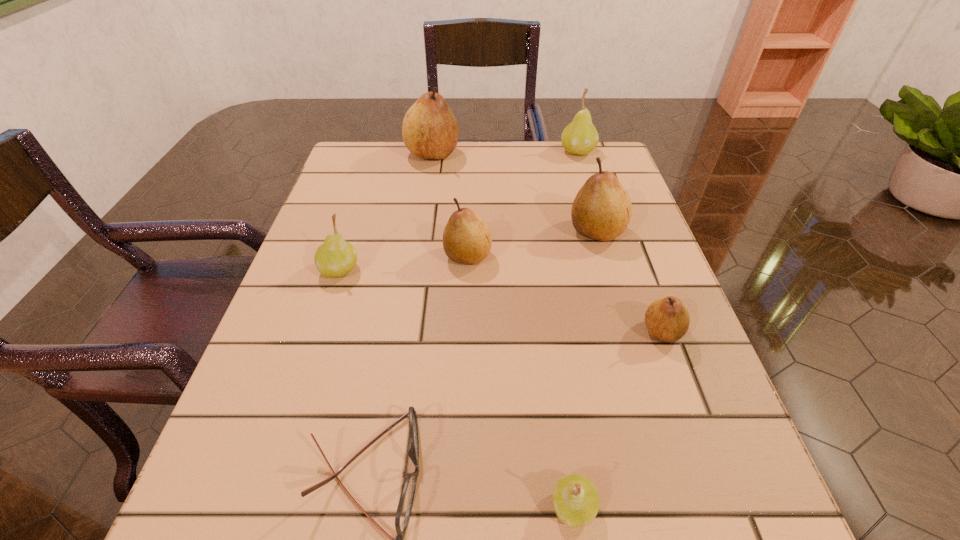
Where is `object at the far left corner`? object at the far left corner is located at coordinates tap(430, 130).

In order to click on object at the far right corner in this screenshot , I will do `click(580, 137)`.

Image resolution: width=960 pixels, height=540 pixels. Identify the location of free space at the far edge of the desktop. (441, 176).

In order to click on vacant area at the left edge in this screenshot , I will do 324,205.

Where is `vacant space at the right edge of the desktop`? Image resolution: width=960 pixels, height=540 pixels. vacant space at the right edge of the desktop is located at coordinates (738, 475).

The height and width of the screenshot is (540, 960). What are the coordinates of `blank space at the far left corner of the desktop` in the screenshot? It's located at (344, 173).

Locate an element on the screen. Image resolution: width=960 pixels, height=540 pixels. vacant space at the far right corner is located at coordinates (559, 141).

At what (x,y) coordinates should I click in order to perform the action: click on vacant space in between the rightmost green pear and the tallest pear. Please return your answer as a coordinate pair (x, y). Looking at the image, I should click on (505, 153).

At what (x,y) coordinates should I click in order to perform the action: click on free point between the farthest brown pear and the nearest green pear. Please return your answer as a coordinate pair (x, y). Looking at the image, I should click on (502, 330).

This screenshot has height=540, width=960. I want to click on vacant area that lies between the second smallest brown pear and the farthest brown pear, so click(x=450, y=205).